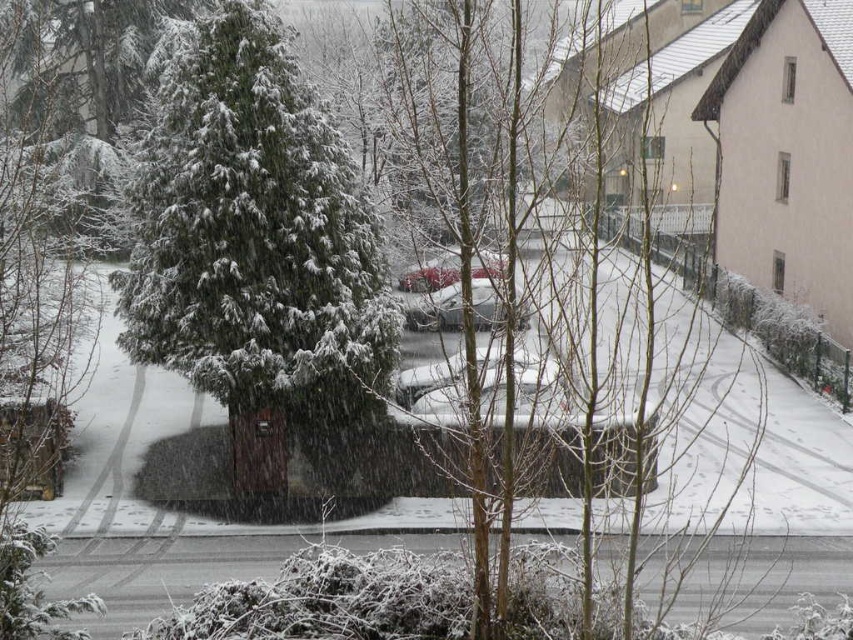
You are a delivery driver who needs to park your truck in the parking lot behind the snowy scene. The parking spot is only 2 meters tall. You see the shiny silver car at center and the metallic red car at center. Which car, if any, can fit into the parking spot based on their height?

The shiny silver car at center is shorter than the metallic red car at center. Since the parking spot is 2 meters tall, the shiny silver car at center can fit, but the metallic red car at center may be too tall.

Looking at this image, you are a delivery driver who needs to park your metallic red car at center without damaging the green matte evergreen tree at left. Based on the scene, is there enough space between them for you to park safely?

→ The green matte evergreen tree at left is located below the metallic red car at center, meaning the tree is positioned lower in the frame. Since the car is at the center and the tree is below it, there should be sufficient vertical space between them for parking without causing damage.